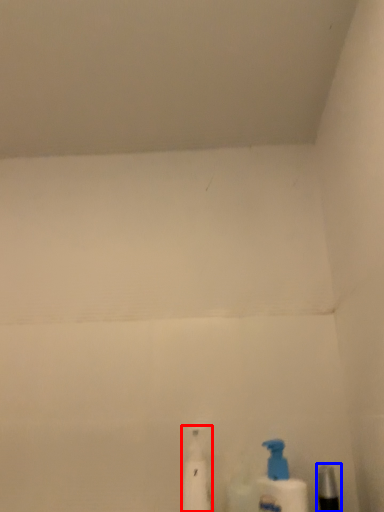
Question: Which of the following is the farthest to the observer, cleaning product (highlighted by a red box) or toiletry (highlighted by a blue box)?

Choices:
 (A) cleaning product
 (B) toiletry

Answer: (A)